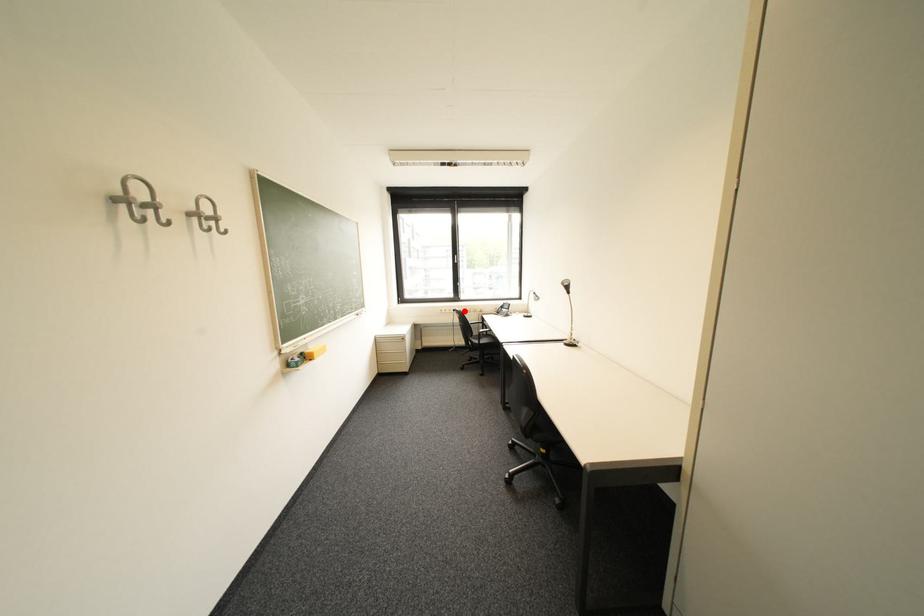
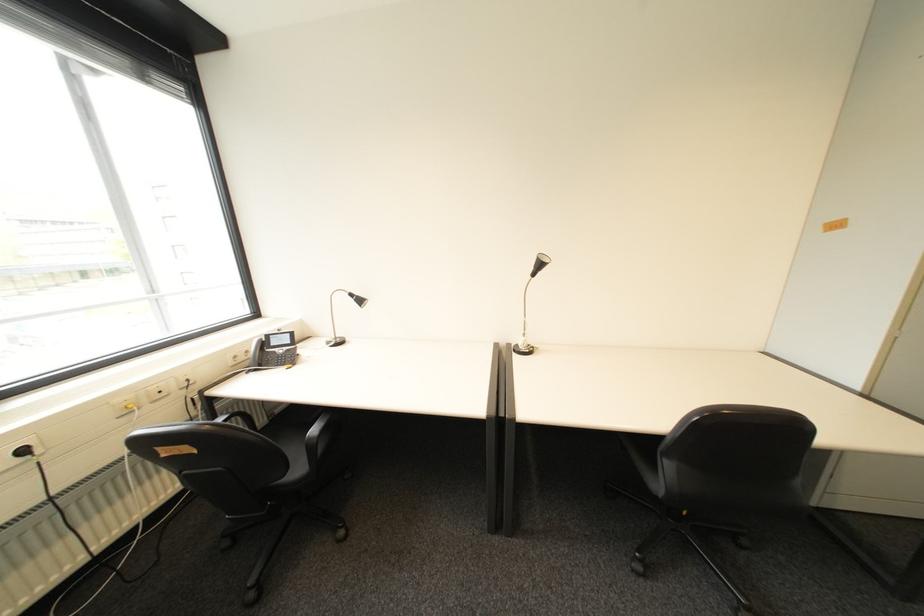
Question: I am providing you with two images of the same scene from different viewpoints. Given a red point in image1, look at the same physical point in image2. Is it:

Choices:
 (A) Closer to the viewpoint
 (B) Farther from the viewpoint

Answer: (A)